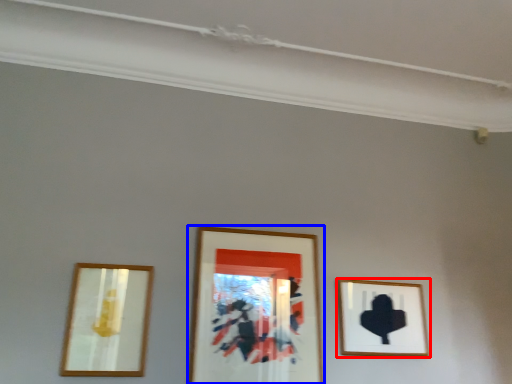
Question: Which object appears farthest to the camera in this image, picture frame (highlighted by a red box) or picture frame (highlighted by a blue box)?

Choices:
 (A) picture frame
 (B) picture frame

Answer: (A)